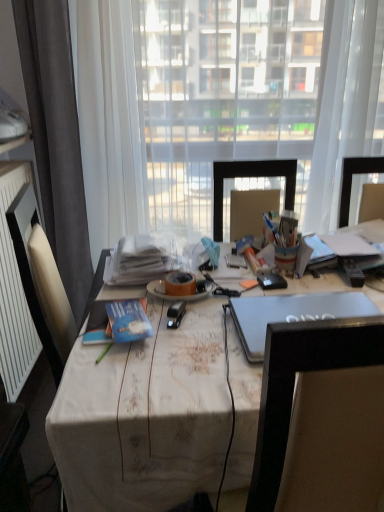
The image size is (384, 512). I want to click on unoccupied area in front of blue matte book at center, acting as the 1th book starting from the front, so click(x=125, y=372).